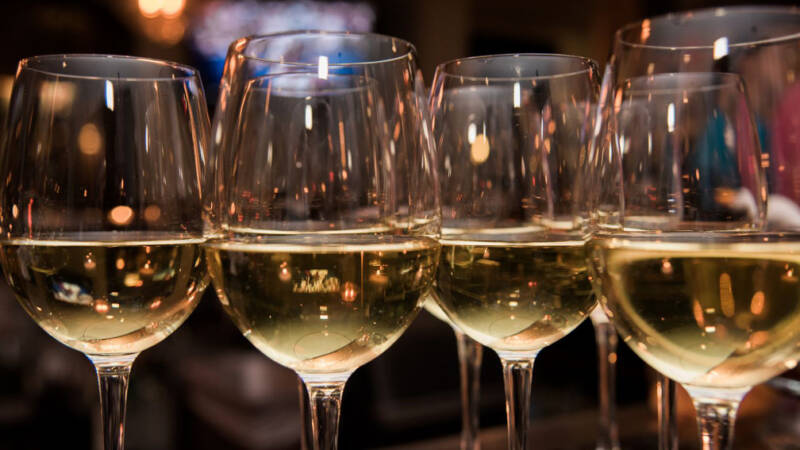
This screenshot has height=450, width=800. Identify the location of shaft of wine glass. (714, 420), (506, 404), (337, 413), (110, 397).